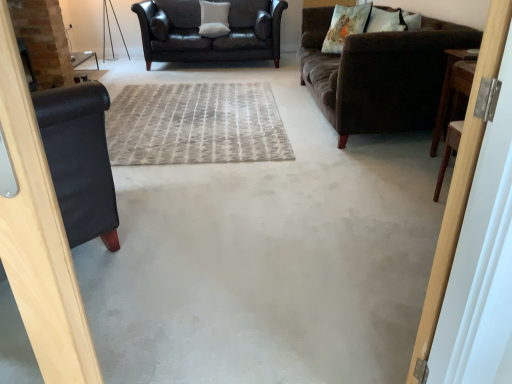
Question: Is floral fabric pillow at upper right, the 2th pillow in the front-to-back sequence, further to camera compared to wooden door at right?

Choices:
 (A) no
 (B) yes

Answer: (B)

Question: From a real-world perspective, is floral fabric pillow at upper right, the 2th pillow viewed from the back, physically above wooden door at right?

Choices:
 (A) yes
 (B) no

Answer: (A)

Question: Does floral fabric pillow at upper right, the 2th pillow in the left-to-right sequence, come in front of wooden door at right?

Choices:
 (A) no
 (B) yes

Answer: (A)

Question: Can you confirm if floral fabric pillow at upper right, the 2th pillow viewed from the back, is positioned to the left of wooden door at right?

Choices:
 (A) yes
 (B) no

Answer: (B)

Question: Considering the relative sizes of floral fabric pillow at upper right, the second pillow viewed from the right, and wooden door at right in the image provided, is floral fabric pillow at upper right, the second pillow viewed from the right, thinner than wooden door at right?

Choices:
 (A) yes
 (B) no

Answer: (B)

Question: From a real-world perspective, is floral fabric pillow at upper right, the 2th pillow in the left-to-right sequence, beneath wooden door at right?

Choices:
 (A) yes
 (B) no

Answer: (B)

Question: Can you confirm if floral fabric pillow at upper right, the second pillow when ordered from bottom to top, is thinner than fluffy white pillow at upper right, the third pillow viewed from the top?

Choices:
 (A) no
 (B) yes

Answer: (B)

Question: Is floral fabric pillow at upper right, the second pillow viewed from the right, positioned beyond the bounds of fluffy white pillow at upper right, marked as the 3th pillow in a left-to-right arrangement?

Choices:
 (A) yes
 (B) no

Answer: (A)

Question: From the image's perspective, is floral fabric pillow at upper right, the 2th pillow in the left-to-right sequence, located above fluffy white pillow at upper right, the third pillow viewed from the top?

Choices:
 (A) yes
 (B) no

Answer: (A)

Question: Considering the relative sizes of floral fabric pillow at upper right, the 2th pillow in the front-to-back sequence, and fluffy white pillow at upper right, the third pillow viewed from the top, in the image provided, is floral fabric pillow at upper right, the 2th pillow in the front-to-back sequence, smaller than fluffy white pillow at upper right, the third pillow viewed from the top,?

Choices:
 (A) no
 (B) yes

Answer: (A)

Question: Is floral fabric pillow at upper right, the second pillow when ordered from bottom to top, wider than fluffy white pillow at upper right, positioned as the first pillow in bottom-to-top order?

Choices:
 (A) yes
 (B) no

Answer: (B)

Question: Is fluffy white pillow at upper right, positioned as the first pillow in bottom-to-top order, surrounded by floral fabric pillow at upper right, which appears as the second pillow when viewed from the top?

Choices:
 (A) yes
 (B) no

Answer: (B)

Question: From the image's perspective, is brown wooden table at right located beneath fluffy white pillow at upper right, the third pillow viewed from the top?

Choices:
 (A) yes
 (B) no

Answer: (A)